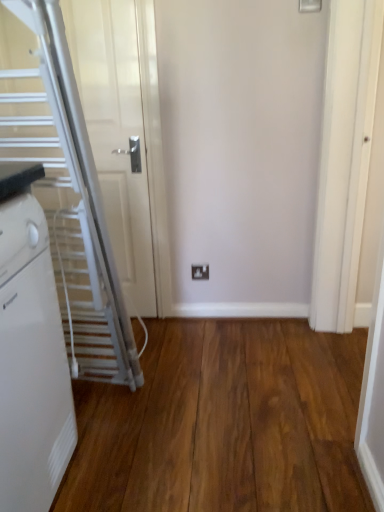
Describe the element at coordinates (224, 423) in the screenshot. I see `brown wood flooring at center` at that location.

Locate an element on the screen. This screenshot has height=512, width=384. white plastic electric outlet at center is located at coordinates (200, 272).

Find the location of a particular element. This screenshot has height=512, width=384. white plastic radiator at left is located at coordinates (30, 352).

Considering the positions of objects white metallic escalator at left and white plastic radiator at left in the image provided, who is behind, white metallic escalator at left or white plastic radiator at left?

white metallic escalator at left is further from the camera.

From the image's perspective, is white metallic escalator at left positioned above or below white plastic radiator at left?

Clearly, from the image's perspective, white metallic escalator at left is above white plastic radiator at left.

Which object is thinner, white metallic escalator at left or white plastic radiator at left?

With smaller width is white metallic escalator at left.

Where is `electric outlet lying above the brown wood flooring at center (from the image's perspective)`? electric outlet lying above the brown wood flooring at center (from the image's perspective) is located at coordinates pos(200,272).

Does white plastic electric outlet at center appear on the left side of brown wood flooring at center?

No, white plastic electric outlet at center is not to the left of brown wood flooring at center.

Looking at the image, does white plastic electric outlet at center seem bigger or smaller compared to brown wood flooring at center?

Considering their sizes, white plastic electric outlet at center takes up less space than brown wood flooring at center.

Is white plastic radiator at left not within brown wood flooring at center?

That's correct, white plastic radiator at left is outside of brown wood flooring at center.

Is white plastic radiator at left positioned before brown wood flooring at center?

Yes, the depth of white plastic radiator at left is less than that of brown wood flooring at center.

Is white plastic radiator at left positioned far away from brown wood flooring at center?

Actually, white plastic radiator at left and brown wood flooring at center are a little close together.

Is white plastic radiator at left oriented towards brown wood flooring at center?

No, white plastic radiator at left does not turn towards brown wood flooring at center.

Does white plastic radiator at left have a greater width compared to white metallic escalator at left?

Indeed, white plastic radiator at left has a greater width compared to white metallic escalator at left.

The image size is (384, 512). I want to click on escalator lying behind the white plastic radiator at left, so click(x=69, y=201).

Considering the relative sizes of white plastic radiator at left and white metallic escalator at left in the image provided, is white plastic radiator at left shorter than white metallic escalator at left?

Indeed, white plastic radiator at left has a lesser height compared to white metallic escalator at left.

Is white plastic radiator at left outside of white metallic escalator at left?

Absolutely, white plastic radiator at left is external to white metallic escalator at left.

Is white plastic radiator at left further to the viewer compared to white plastic electric outlet at center?

No, it is in front of white plastic electric outlet at center.

Is white plastic radiator at left touching white plastic electric outlet at center?

white plastic radiator at left is not next to white plastic electric outlet at center, and they're not touching.

Which of these two, white plastic radiator at left or white plastic electric outlet at center, is smaller?

white plastic electric outlet at center is smaller.

From the image's perspective, is white plastic radiator at left located beneath white plastic electric outlet at center?

Correct, white plastic radiator at left appears lower than white plastic electric outlet at center in the image.

Which object is further away from the camera, white metallic escalator at left or brown wood flooring at center?

Positioned behind is white metallic escalator at left.

Are white metallic escalator at left and brown wood flooring at center located far from each other?

That's not correct — white metallic escalator at left is a little close to brown wood flooring at center.

Which is further, (59, 104) or (147, 413)?

Point (147, 413)

How much distance is there between white metallic escalator at left and brown wood flooring at center?

They are 49.17 centimeters apart.

How many degrees apart are the facing directions of white metallic escalator at left and white plastic electric outlet at center?

They differ by 0.425 degrees in their facing directions.

From the image's perspective, which object appears higher, white metallic escalator at left or white plastic electric outlet at center?

white metallic escalator at left appears higher in the image.

Can we say white metallic escalator at left lies outside white plastic electric outlet at center?

Absolutely, white metallic escalator at left is external to white plastic electric outlet at center.

Is white metallic escalator at left oriented towards white plastic electric outlet at center?

No, white metallic escalator at left is not turned towards white plastic electric outlet at center.

At what (x,y) coordinates should I click in order to perform the action: click on escalator behind the white plastic radiator at left. Please return your answer as a coordinate pair (x, y). Looking at the image, I should click on (69, 201).

This screenshot has height=512, width=384. What are the coordinates of `hardwood on the left of white plastic electric outlet at center` in the screenshot? It's located at (224, 423).

Based on their spatial positions, is white plastic radiator at left or brown wood flooring at center further from white metallic escalator at left?

brown wood flooring at center.

Looking at the image, which one is located closer to brown wood flooring at center, white plastic radiator at left or white plastic electric outlet at center?

The object closer to brown wood flooring at center is white plastic radiator at left.

Estimate the real-world distances between objects in this image. Which object is closer to white plastic radiator at left, white metallic escalator at left or brown wood flooring at center?

The object closer to white plastic radiator at left is white metallic escalator at left.

Estimate the real-world distances between objects in this image. Which object is further from white plastic electric outlet at center, white metallic escalator at left or white plastic radiator at left?

The object further to white plastic electric outlet at center is white plastic radiator at left.

From the image, which object appears to be nearer to brown wood flooring at center, white metallic escalator at left or white plastic radiator at left?

Among the two, white metallic escalator at left is located nearer to brown wood flooring at center.

Considering their positions, is white plastic radiator at left positioned further to white metallic escalator at left than white plastic electric outlet at center?

Among the two, white plastic electric outlet at center is located further to white metallic escalator at left.

Which object lies further to the anchor point brown wood flooring at center, white plastic radiator at left or white metallic escalator at left?

Among the two, white plastic radiator at left is located further to brown wood flooring at center.

When comparing their distances from white plastic radiator at left, does white plastic electric outlet at center or white metallic escalator at left seem further?

white plastic electric outlet at center lies further to white plastic radiator at left than the other object.

Identify the location of escalator between brown wood flooring at center and white plastic electric outlet at center from front to back. (69, 201).

This screenshot has height=512, width=384. I want to click on hardwood positioned between white plastic radiator at left and white metallic escalator at left from near to far, so click(x=224, y=423).

Where is `hardwood between white plastic radiator at left and white plastic electric outlet at center from front to back`? This screenshot has width=384, height=512. hardwood between white plastic radiator at left and white plastic electric outlet at center from front to back is located at coordinates (224, 423).

Find the location of a particular element. Image resolution: width=384 pixels, height=512 pixels. escalator between white plastic radiator at left and white plastic electric outlet at center in the front-back direction is located at coordinates (69, 201).